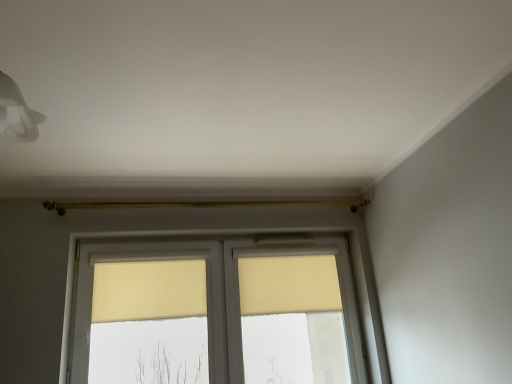
Question: Based on their sizes in the image, would you say beige fabric curtain at center, the first curtain when ordered from right to left, is bigger or smaller than beige fabric curtain at center, the first curtain when ordered from left to right?

Choices:
 (A) big
 (B) small

Answer: (A)

Question: From the image's perspective, is beige fabric curtain at center, the first curtain when ordered from right to left, above or below beige fabric curtain at center, the first curtain when ordered from left to right?

Choices:
 (A) below
 (B) above

Answer: (B)

Question: Which object is positioned farthest from the beige fabric curtain at center, the first curtain when ordered from right to left?

Choices:
 (A) matte yellow window at center
 (B) beige fabric curtain at center, acting as the 2th curtain starting from the right

Answer: (B)

Question: Which object is positioned closest to the beige fabric curtain at center, the first curtain when ordered from left to right?

Choices:
 (A) beige fabric curtain at center, the first curtain when ordered from right to left
 (B) matte yellow window at center

Answer: (B)